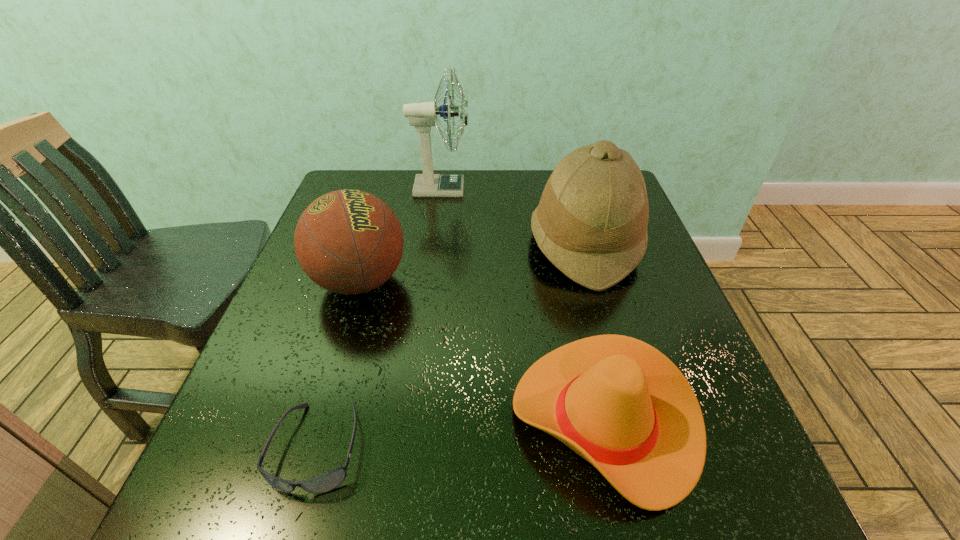
You are a GUI agent. You are given a task and a screenshot of the screen. Output one action in this format:
    pyautogui.click(x=<x>, y=<y>)
    Task: Click on the fan
    The height and width of the screenshot is (540, 960).
    Given the screenshot: What is the action you would take?
    pyautogui.click(x=422, y=115)

The image size is (960, 540). What are the coordinates of `hat` in the screenshot? It's located at [591, 223].

Identify the location of basketball. (347, 241).

What are the coordinates of `cowboy hat` in the screenshot? It's located at (619, 403).

Image resolution: width=960 pixels, height=540 pixels. Identify the location of the shortest object. (326, 482).

Find the location of a particular element. The width and height of the screenshot is (960, 540). free spot located 0.190m on the front-facing side of the fan is located at coordinates (533, 188).

Identify the location of free space located 0.400m on the front-facing side of the hat. This screenshot has width=960, height=540. (372, 244).

I want to click on vacant region located on the front-facing side of the hat, so click(459, 244).

Image resolution: width=960 pixels, height=540 pixels. I want to click on free space located on the front-facing side of the hat, so click(x=467, y=244).

Locate an element on the screen. Image resolution: width=960 pixels, height=540 pixels. vacant space located on the front of the basketball is located at coordinates (344, 335).